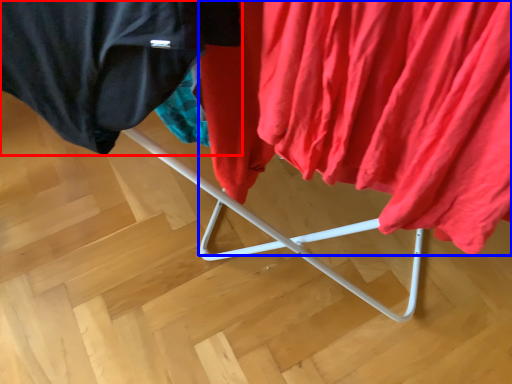
Question: Which point is further to the camera, cloak (highlighted by a red box) or curtain (highlighted by a blue box)?

Choices:
 (A) cloak
 (B) curtain

Answer: (A)